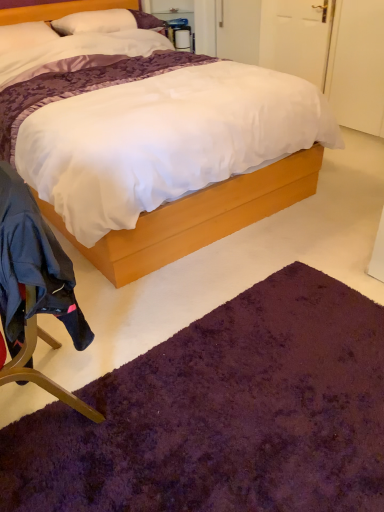
Question: Is purple shaggy rug at lower center positioned behind white matte door at upper right?

Choices:
 (A) no
 (B) yes

Answer: (A)

Question: Is purple shaggy rug at lower center in front of white matte door at upper right?

Choices:
 (A) no
 (B) yes

Answer: (B)

Question: Would you say purple shaggy rug at lower center is a long distance from white matte door at upper right?

Choices:
 (A) no
 (B) yes

Answer: (B)

Question: Is purple shaggy rug at lower center placed right next to white matte door at upper right?

Choices:
 (A) yes
 (B) no

Answer: (B)

Question: Considering the relative sizes of purple shaggy rug at lower center and white matte door at upper right in the image provided, is purple shaggy rug at lower center wider than white matte door at upper right?

Choices:
 (A) yes
 (B) no

Answer: (A)

Question: Considering the positions of point (x=332, y=11) and point (x=175, y=223), is point (x=332, y=11) closer or farther from the camera than point (x=175, y=223)?

Choices:
 (A) closer
 (B) farther

Answer: (B)

Question: From the image's perspective, is white matte door at upper right positioned above or below purple plush rug at lower center?

Choices:
 (A) below
 (B) above

Answer: (B)

Question: Do you think white matte door at upper right is within purple plush rug at lower center, or outside of it?

Choices:
 (A) outside
 (B) inside

Answer: (A)

Question: From a real-world perspective, is white matte door at upper right above or below purple plush rug at lower center?

Choices:
 (A) below
 (B) above

Answer: (B)

Question: Is point (218, 214) positioned closer to the camera than point (61, 457)?

Choices:
 (A) farther
 (B) closer

Answer: (A)

Question: Is purple plush rug at lower center taller or shorter than purple shaggy rug at lower center?

Choices:
 (A) short
 (B) tall

Answer: (B)

Question: In the image, is purple plush rug at lower center positioned in front of or behind purple shaggy rug at lower center?

Choices:
 (A) behind
 (B) front

Answer: (A)

Question: Is purple plush rug at lower center situated inside purple shaggy rug at lower center or outside?

Choices:
 (A) outside
 (B) inside

Answer: (A)

Question: From the image's perspective, is white soft pillow at upper left positioned above or below white matte door at upper right?

Choices:
 (A) above
 (B) below

Answer: (B)

Question: Considering the positions of point (137, 26) and point (322, 7), is point (137, 26) closer or farther from the camera than point (322, 7)?

Choices:
 (A) farther
 (B) closer

Answer: (B)